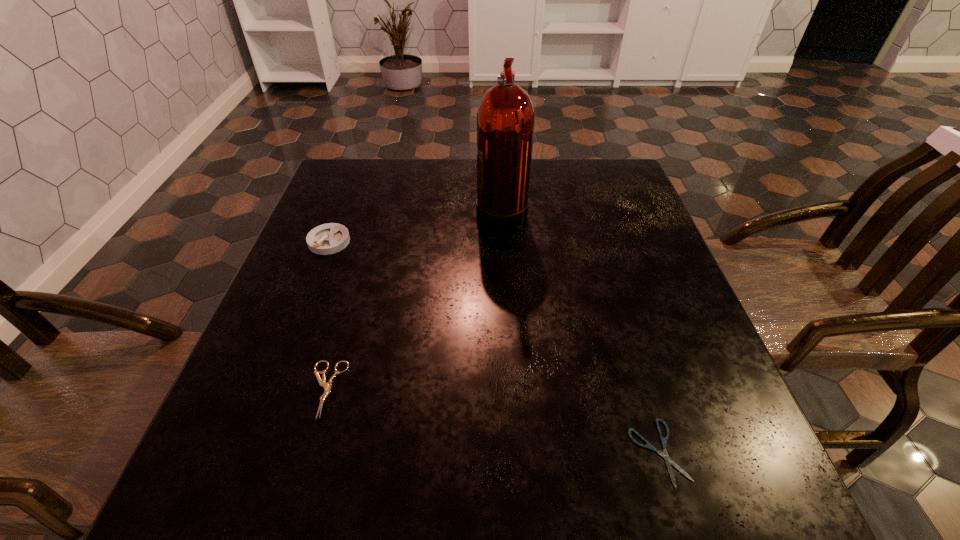
At what (x,y) coordinates should I click in order to perform the action: click on vacant area between the ashtray and the left shears. Please return your answer as a coordinate pair (x, y). This screenshot has height=540, width=960. Looking at the image, I should click on (327, 315).

I want to click on free space between the tallest object and the taller shears, so click(414, 300).

Find the location of a particular element. vacant area that lies between the ashtray and the fire extinguisher is located at coordinates (416, 226).

At what (x,y) coordinates should I click in order to perform the action: click on vacant space in between the shortest object and the leftmost object. Please return your answer as a coordinate pair (x, y). The width and height of the screenshot is (960, 540). Looking at the image, I should click on (493, 347).

Find the location of a particular element. The image size is (960, 540). blank region between the tallest object and the left shears is located at coordinates (414, 300).

I want to click on vacant area that lies between the second object from right to left and the shortest object, so click(580, 332).

Find the location of a particular element. The height and width of the screenshot is (540, 960). object that stands as the closest to the second shortest object is located at coordinates (329, 238).

Point out which object is positioned as the nearest to the third shortest object. Please provide its 2D coordinates. Your answer should be formatted as a tuple, i.e. [(x, y)], where the tuple contains the x and y coordinates of a point satisfying the conditions above.

[(327, 387)]

You are a GUI agent. You are given a task and a screenshot of the screen. Output one action in this format:
    pyautogui.click(x=<x>, y=<y>)
    Task: Click on the vacant point that satisfies the following two spatial constraints: 1. on the front-facing side of the rightmost object; 2. on the right side of the tallest object
    This screenshot has height=540, width=960.
    Given the screenshot: What is the action you would take?
    pyautogui.click(x=516, y=452)

This screenshot has height=540, width=960. What are the coordinates of `free spot that satisfies the following two spatial constraints: 1. on the front-facing side of the tallest object; 2. on the right side of the shortest object` in the screenshot? It's located at (516, 452).